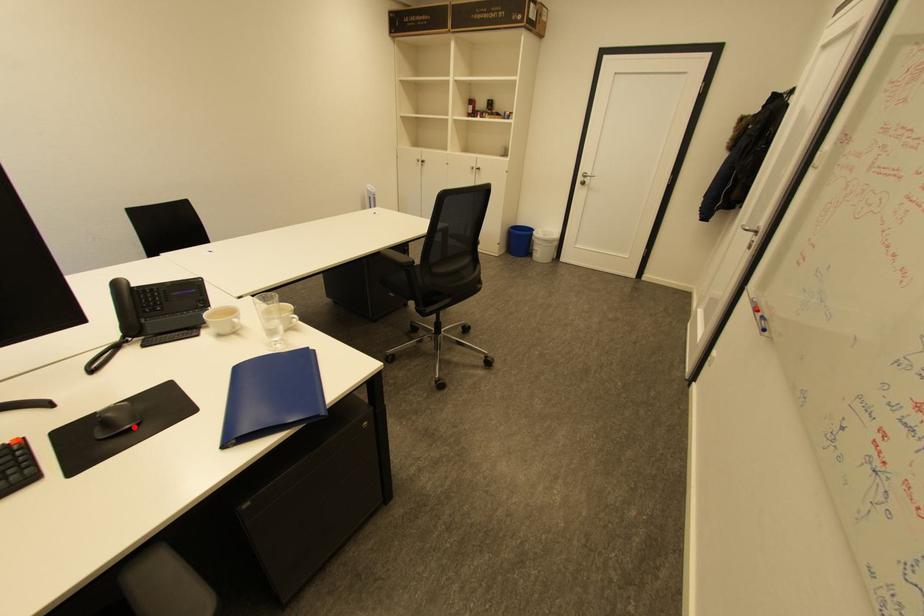
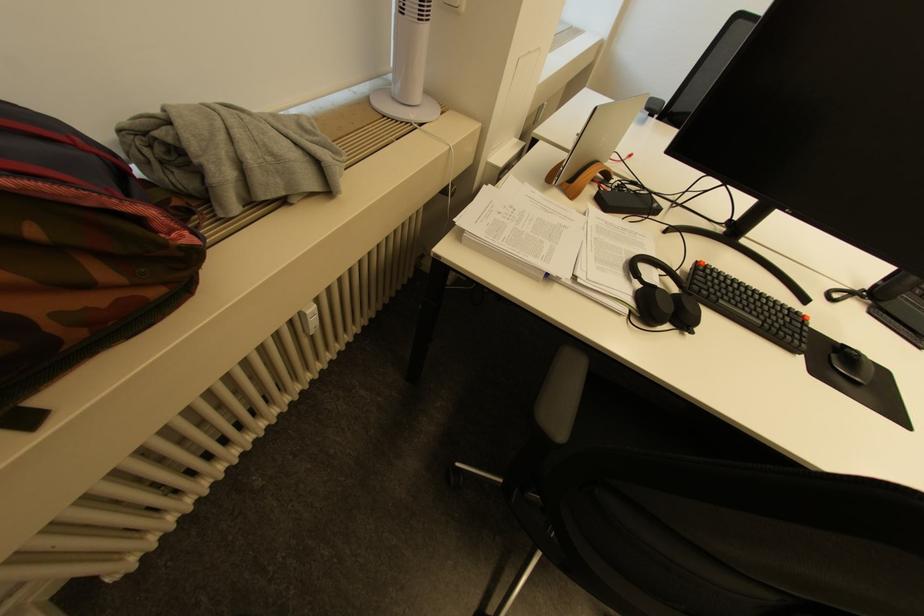
The point at the highlighted location is marked in the first image. Where is the corresponding point in the second image?

(865, 381)